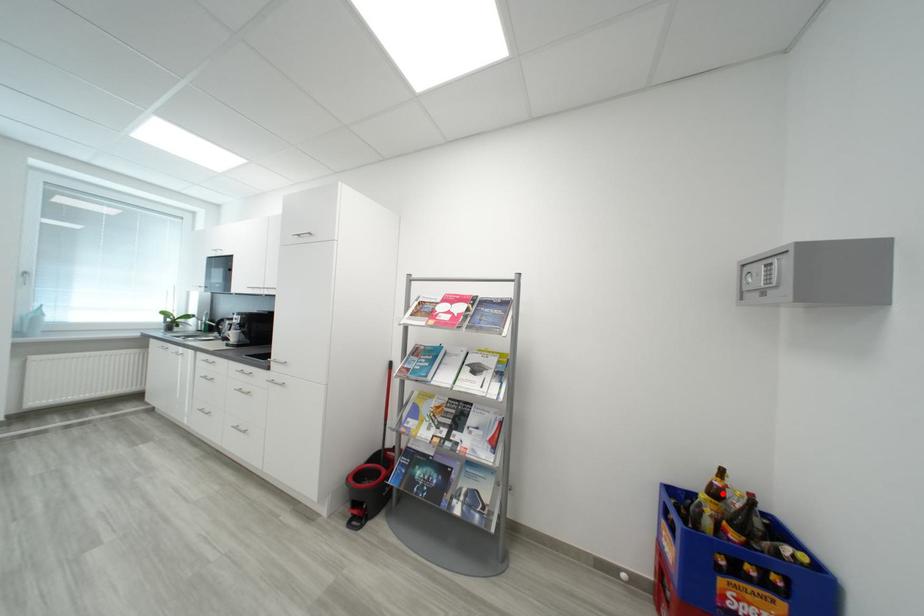
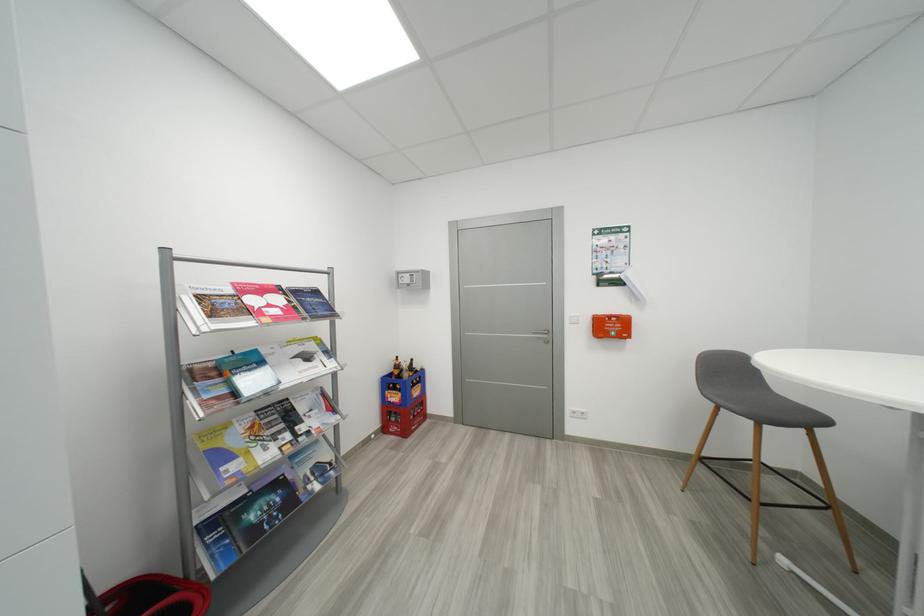
Question: I am providing you with two images of the same scene from different viewpoints. A red point is shown in image1. For the corresponding object point in image2, is it positioned nearer or farther from the camera?

Choices:
 (A) Nearer
 (B) Farther

Answer: (B)